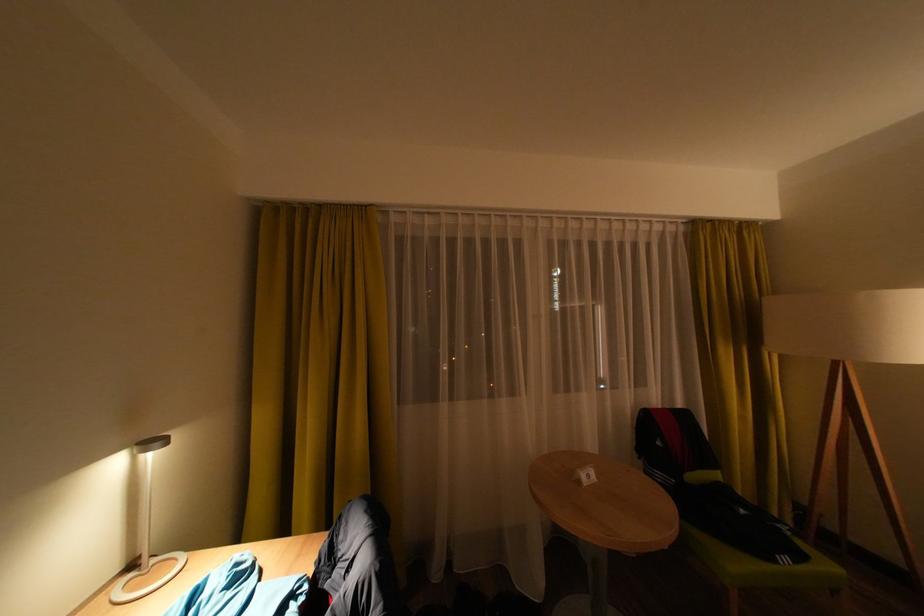
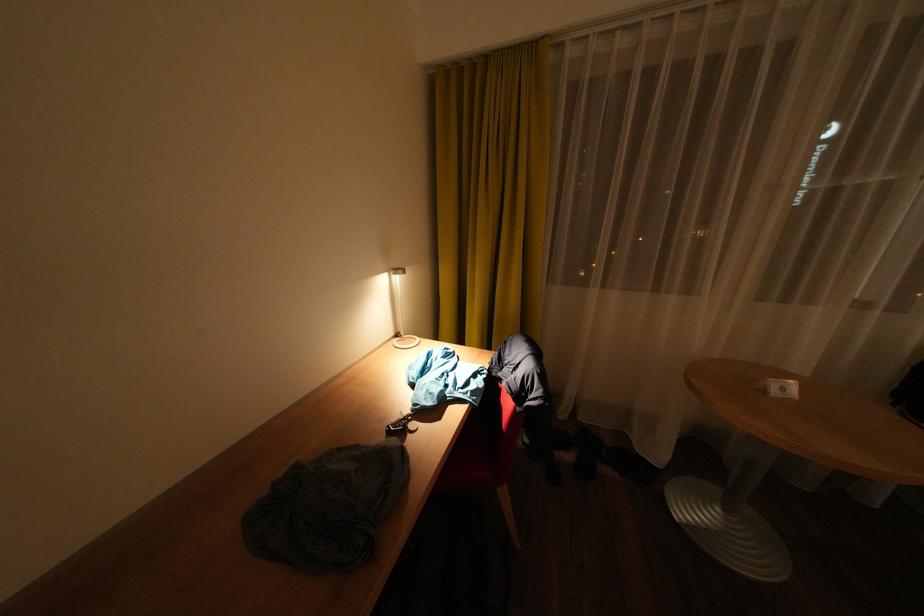
The images are taken continuously from a first-person perspective. In which direction is your viewpoint rotating?

The camera rotated toward left-down.